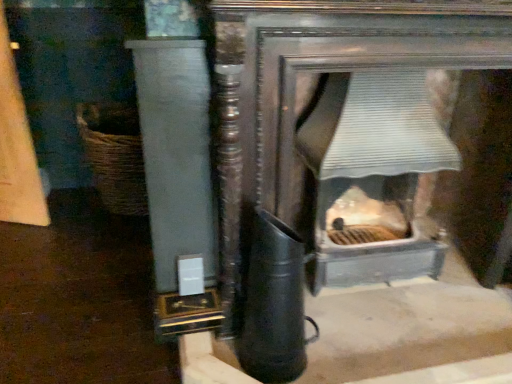
Question: Does white glossy pillar at left lie behind metallic gray fireplace at center?

Choices:
 (A) no
 (B) yes

Answer: (A)

Question: From a real-world perspective, is white glossy pillar at left physically below metallic gray fireplace at center?

Choices:
 (A) yes
 (B) no

Answer: (B)

Question: From the image's perspective, is white glossy pillar at left located beneath metallic gray fireplace at center?

Choices:
 (A) yes
 (B) no

Answer: (A)

Question: Does white glossy pillar at left have a lesser width compared to metallic gray fireplace at center?

Choices:
 (A) yes
 (B) no

Answer: (A)

Question: Is white glossy pillar at left facing away from metallic gray fireplace at center?

Choices:
 (A) yes
 (B) no

Answer: (B)

Question: From the image's perspective, is white glossy pillar at left on metallic gray fireplace at center?

Choices:
 (A) yes
 (B) no

Answer: (B)

Question: Is metallic gray fireplace at center shorter than white glossy pillar at left?

Choices:
 (A) no
 (B) yes

Answer: (B)

Question: Is metallic gray fireplace at center located outside white glossy pillar at left?

Choices:
 (A) no
 (B) yes

Answer: (B)

Question: From a real-world perspective, is metallic gray fireplace at center physically below white glossy pillar at left?

Choices:
 (A) yes
 (B) no

Answer: (A)

Question: Would you say metallic gray fireplace at center contains white glossy pillar at left?

Choices:
 (A) no
 (B) yes

Answer: (A)

Question: Is metallic gray fireplace at center to the right of white glossy pillar at left from the viewer's perspective?

Choices:
 (A) no
 (B) yes

Answer: (B)

Question: From the image's perspective, does metallic gray fireplace at center appear higher than white glossy pillar at left?

Choices:
 (A) yes
 (B) no

Answer: (A)

Question: Is woven brown basket at left to the left of white glossy pillar at left from the viewer's perspective?

Choices:
 (A) no
 (B) yes

Answer: (B)